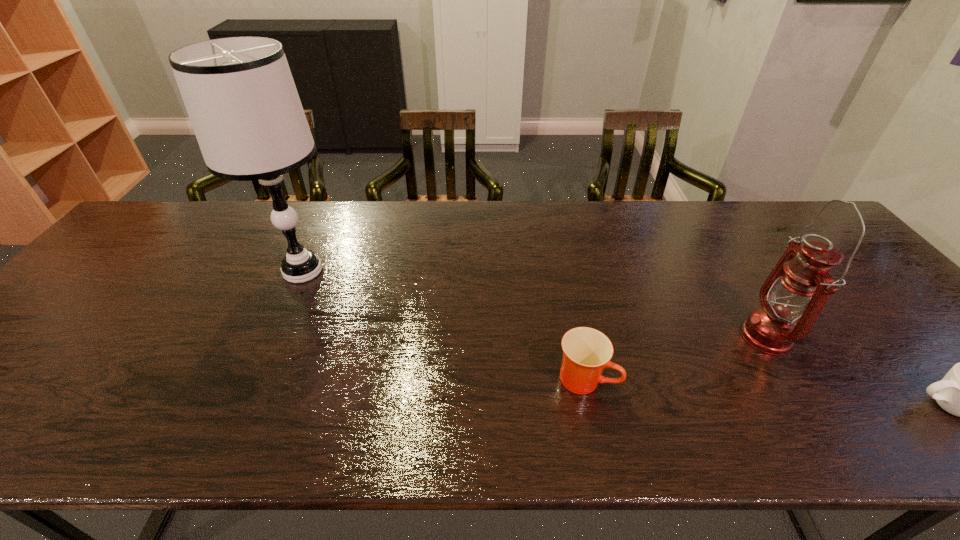
The image size is (960, 540). I want to click on vacant region that satisfies the following two spatial constraints: 1. on the back side of the third object from left to right; 2. on the right side of the left cup, so click(x=576, y=336).